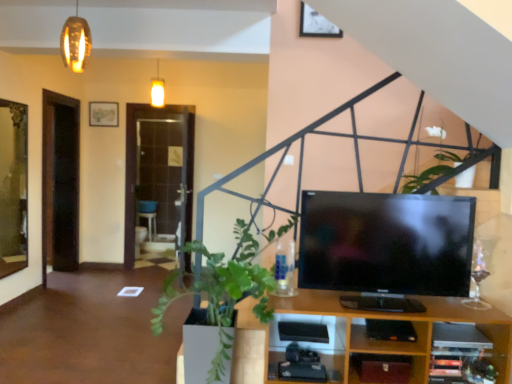
What do you see at coordinates (316, 24) in the screenshot?
I see `metallic silver picture frame at upper center` at bounding box center [316, 24].

Measure the distance between white glossy flower at upper center and camera.

A distance of 2.64 meters exists between white glossy flower at upper center and camera.

Identify the location of green leafy plant at lower left. The height and width of the screenshot is (384, 512). (225, 288).

This screenshot has height=384, width=512. I want to click on metallic silver picture frame at upper center, so click(316, 24).

Considering the points (323, 21) and (222, 305), which point is behind, point (323, 21) or point (222, 305)?

Point (323, 21)

Considering the sizes of objects metallic silver picture frame at upper center and green leafy plant at lower left in the image provided, who is smaller, metallic silver picture frame at upper center or green leafy plant at lower left?

metallic silver picture frame at upper center is smaller.

Based on the photo, is metallic silver picture frame at upper center shorter than green leafy plant at lower left?

Correct, metallic silver picture frame at upper center is not as tall as green leafy plant at lower left.

Is metallic silver picture frame at upper center further to camera compared to green leafy plant at lower left?

Yes, it is.

Based on the photo, does green leafy plant at lower left appear on the left side of white glossy flower at upper center?

Indeed, green leafy plant at lower left is positioned on the left side of white glossy flower at upper center.

Which object is further away from the camera, green leafy plant at lower left or white glossy flower at upper center?

white glossy flower at upper center.

Is green leafy plant at lower left facing towards white glossy flower at upper center?

No, green leafy plant at lower left is not facing towards white glossy flower at upper center.

Is green leafy plant at lower left not within white glossy flower at upper center?

Yes, green leafy plant at lower left is outside of white glossy flower at upper center.

Is point (249, 293) farther from viewer compared to point (325, 18)?

No, (249, 293) is in front of (325, 18).

Is green leafy plant at lower left to the right of metallic silver picture frame at upper center from the viewer's perspective?

No, green leafy plant at lower left is not to the right of metallic silver picture frame at upper center.

Is the surface of green leafy plant at lower left in direct contact with metallic silver picture frame at upper center?

green leafy plant at lower left and metallic silver picture frame at upper center are not in contact.

Is green leafy plant at lower left wider than metallic silver picture frame at upper center?

Correct, the width of green leafy plant at lower left exceeds that of metallic silver picture frame at upper center.

Between metallic silver picture frame at upper center and white glossy flower at upper center, which one has smaller size?

Smaller between the two is metallic silver picture frame at upper center.

From the image's perspective, is metallic silver picture frame at upper center on top of white glossy flower at upper center?

Yes, from the image's perspective, metallic silver picture frame at upper center is above white glossy flower at upper center.

Choose the correct answer: Is metallic silver picture frame at upper center inside white glossy flower at upper center or outside it?

metallic silver picture frame at upper center exists outside the volume of white glossy flower at upper center.

Considering the sizes of metallic silver picture frame at upper center and white glossy flower at upper center in the image, is metallic silver picture frame at upper center wider or thinner than white glossy flower at upper center?

metallic silver picture frame at upper center is thinner than white glossy flower at upper center.

Is white glossy flower at upper center next to green leafy plant at lower left and touching it?

white glossy flower at upper center and green leafy plant at lower left are not in contact.

From a real-world perspective, is white glossy flower at upper center positioned under green leafy plant at lower left based on gravity?

No, from a real-world perspective, white glossy flower at upper center is not under green leafy plant at lower left.

Is the depth of white glossy flower at upper center greater than that of green leafy plant at lower left?

Yes.

From a real-world perspective, is white glossy flower at upper center positioned under metallic silver picture frame at upper center based on gravity?

Yes, from a real-world perspective, white glossy flower at upper center is below metallic silver picture frame at upper center.

How many degrees apart are the facing directions of white glossy flower at upper center and metallic silver picture frame at upper center?

The angle between the facing direction of white glossy flower at upper center and the facing direction of metallic silver picture frame at upper center is 89.7 degrees.

Considering the relative sizes of white glossy flower at upper center and metallic silver picture frame at upper center in the image provided, is white glossy flower at upper center taller than metallic silver picture frame at upper center?

Yes.

Based on the photo, is white glossy flower at upper center smaller than metallic silver picture frame at upper center?

No.

I want to click on picture frame positioned vertically above the green leafy plant at lower left (from a real-world perspective), so click(x=316, y=24).

What are the coordinates of `houseplant that appears on the left of white glossy flower at upper center` in the screenshot? It's located at [225, 288].

From the image, which object appears to be farther from metallic silver picture frame at upper center, green leafy plant at lower left or white glossy flower at upper center?

green leafy plant at lower left is positioned further to the anchor metallic silver picture frame at upper center.

Based on their spatial positions, is white glossy flower at upper center or metallic silver picture frame at upper center closer to green leafy plant at lower left?

white glossy flower at upper center.

Looking at this image, considering their positions, is metallic silver picture frame at upper center positioned further to white glossy flower at upper center than green leafy plant at lower left?

metallic silver picture frame at upper center is further to white glossy flower at upper center.

When comparing their distances from green leafy plant at lower left, does metallic silver picture frame at upper center or white glossy flower at upper center seem further?

Based on the image, metallic silver picture frame at upper center appears to be further to green leafy plant at lower left.

Based on their spatial positions, is green leafy plant at lower left or metallic silver picture frame at upper center closer to white glossy flower at upper center?

green leafy plant at lower left is positioned closer to the anchor white glossy flower at upper center.

Considering their positions, is white glossy flower at upper center positioned closer to metallic silver picture frame at upper center than green leafy plant at lower left?

white glossy flower at upper center is closer to metallic silver picture frame at upper center.

Image resolution: width=512 pixels, height=384 pixels. Find the location of `plant that lies between metallic silver picture frame at upper center and green leafy plant at lower left from top to bottom`. plant that lies between metallic silver picture frame at upper center and green leafy plant at lower left from top to bottom is located at coordinates (443, 170).